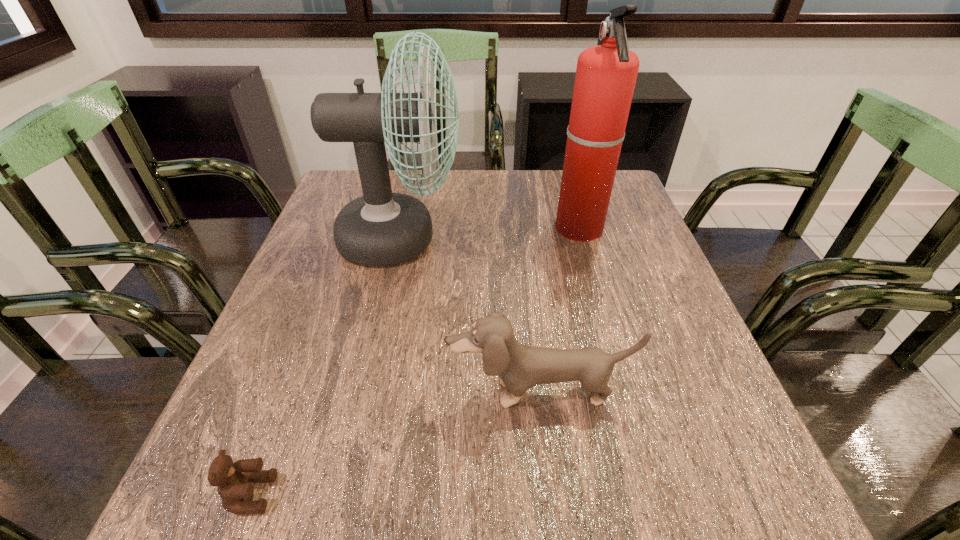
At what (x,y) coordinates should I click in order to perform the action: click on free space that satisfies the following two spatial constraints: 1. with the nozzle and gauge on the fire extinguisher; 2. at the face of the third tallest object. Please return your answer as a coordinate pair (x, y). Looking at the image, I should click on (626, 392).

Find the location of a particular element. Image resolution: width=960 pixels, height=540 pixels. vacant space that satisfies the following two spatial constraints: 1. at the face of the third farthest object; 2. on the face of the teddy bear is located at coordinates (551, 494).